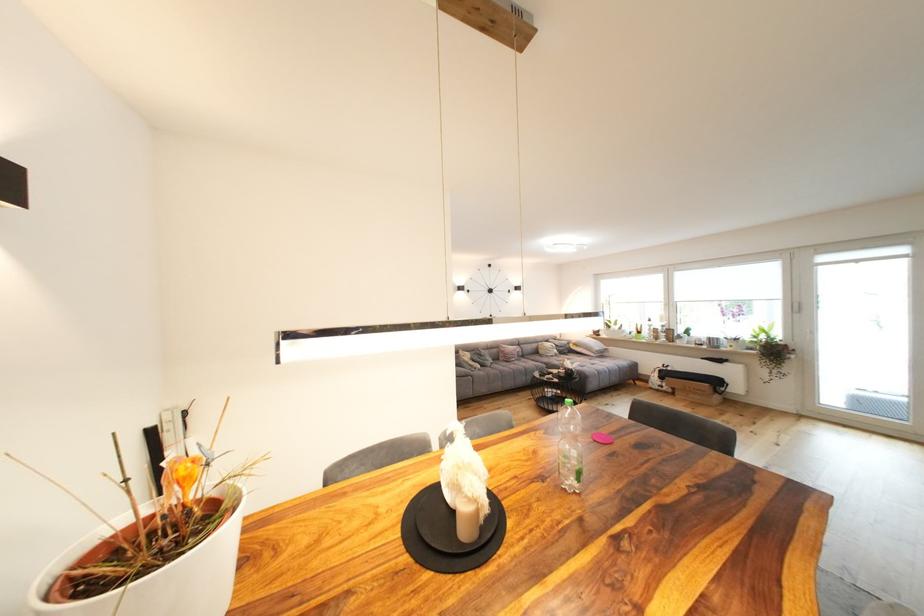
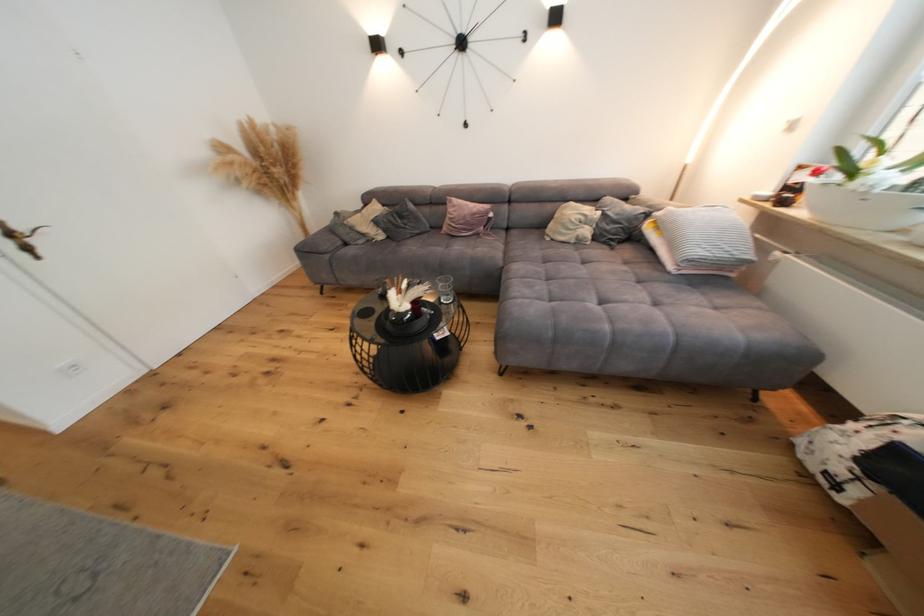
Question: I am providing you with two images of the same scene from different viewpoints. Please identify which objects are invisible in image2.

Choices:
 (A) metal door handle
 (B) clear drinking glass
 (C) white plant pot
 (D) none of these

Answer: (D)